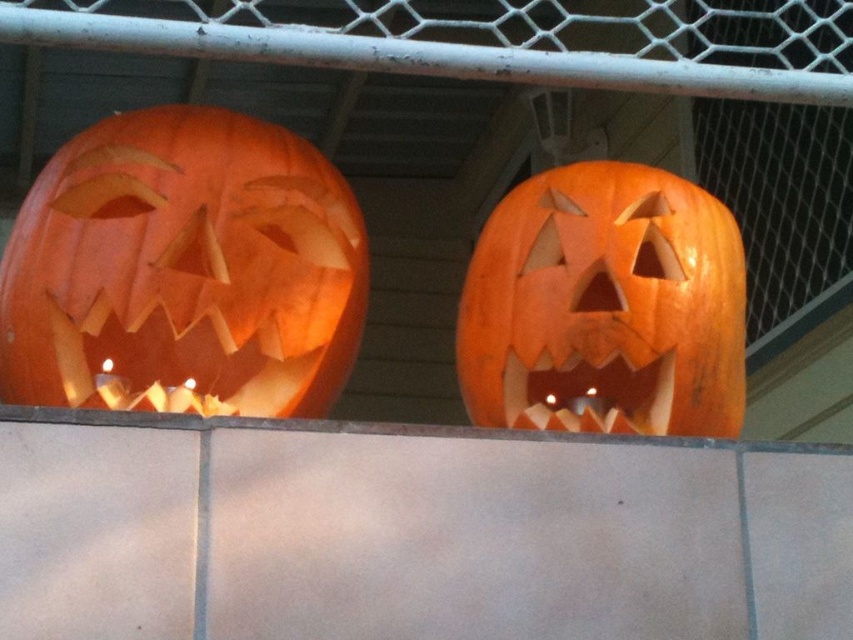
Question: Which object appears farthest from the camera in this image?

Choices:
 (A) orange carved pumpkin at left
 (B) orange carved pumpkin at center

Answer: (B)

Question: Can you confirm if orange carved pumpkin at left is smaller than orange carved pumpkin at center?

Choices:
 (A) no
 (B) yes

Answer: (A)

Question: Is orange carved pumpkin at left closer to the viewer compared to orange carved pumpkin at center?

Choices:
 (A) no
 (B) yes

Answer: (B)

Question: Is orange carved pumpkin at left positioned in front of orange carved pumpkin at center?

Choices:
 (A) yes
 (B) no

Answer: (A)